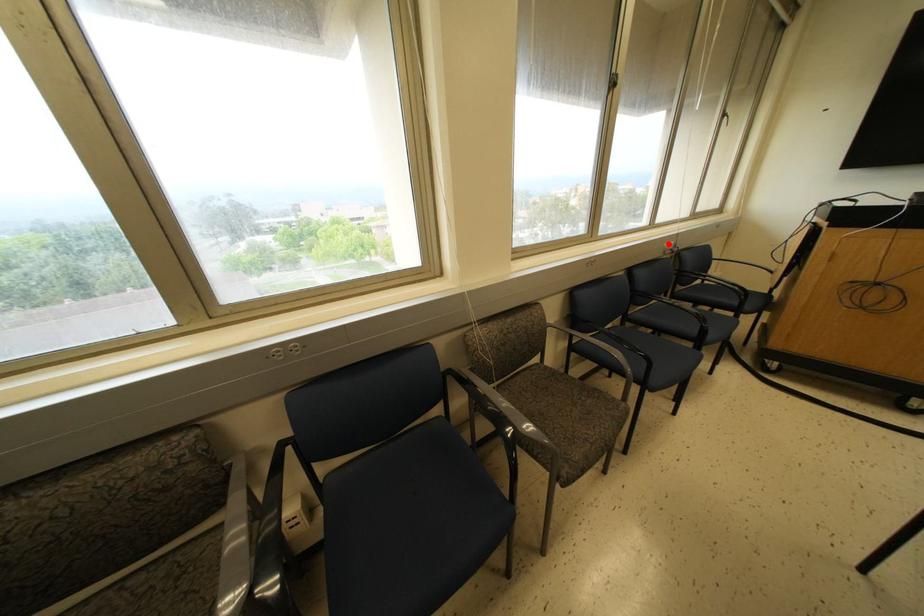
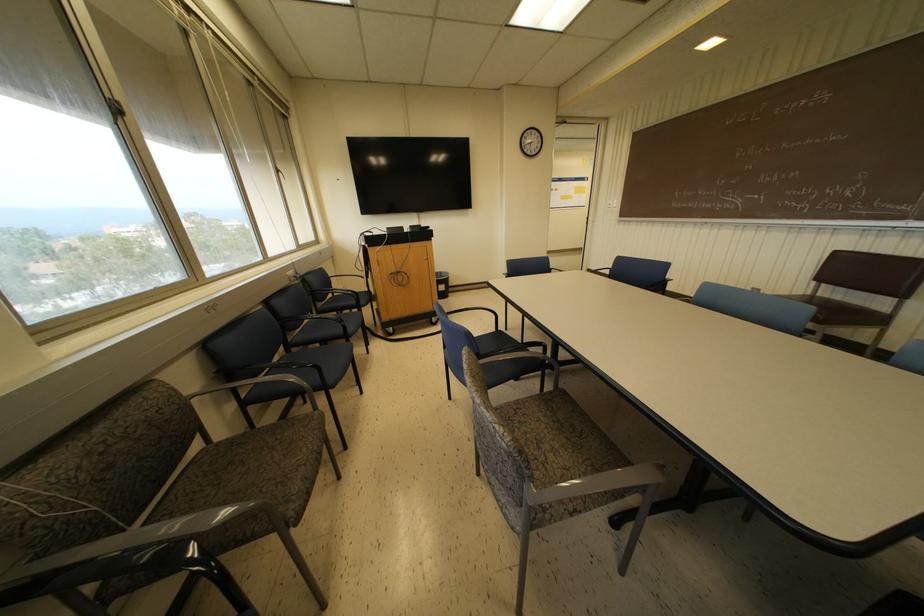
Where in the second image is the point corresponding to the highlighted location from the first image?

(289, 272)